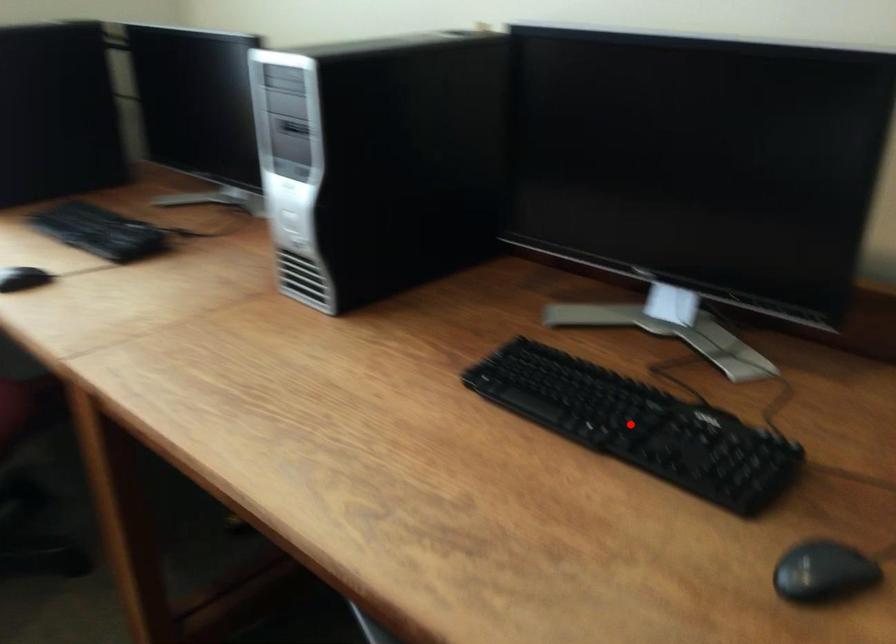
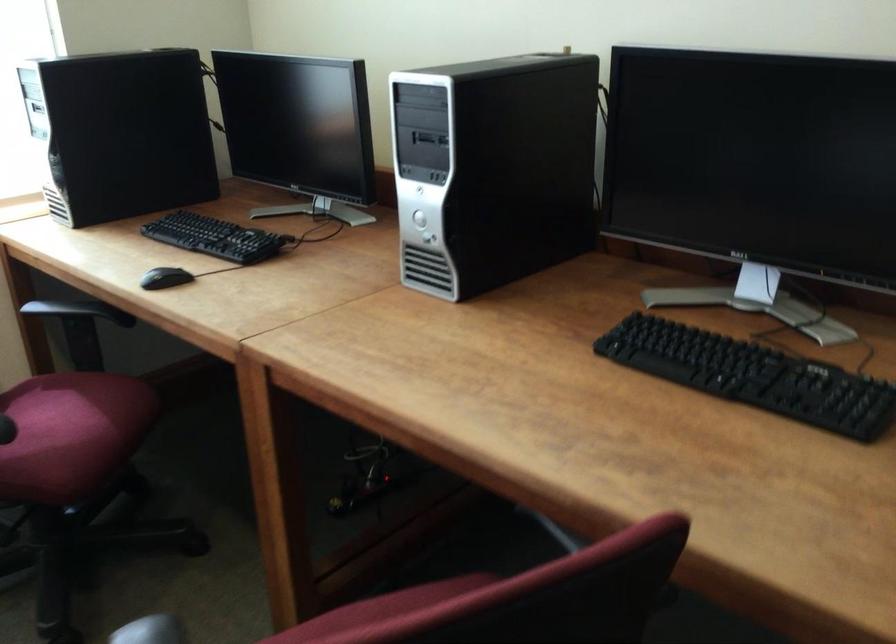
Where in the second image is the point corresponding to the highlighted location from the first image?

(753, 375)